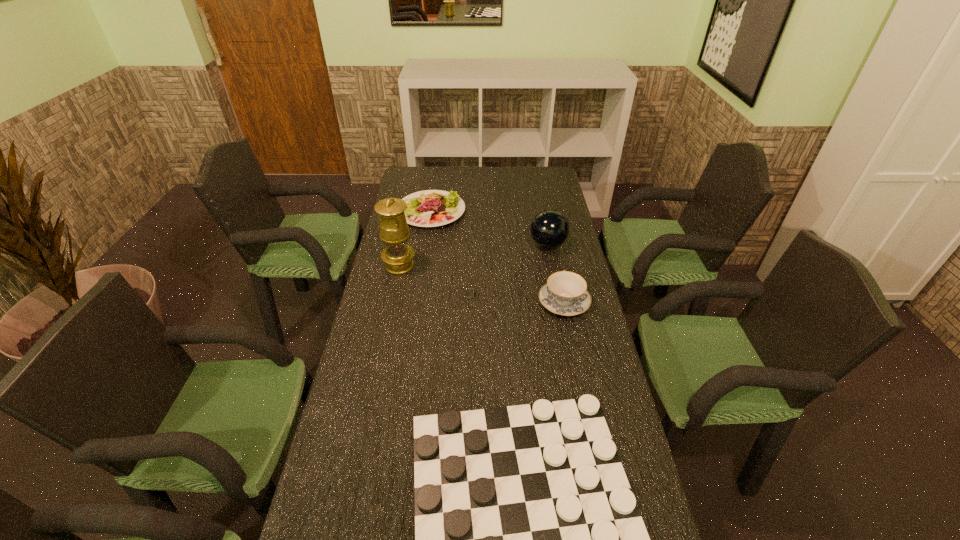
Identify the location of oil lamp. (394, 232).

Locate an element on the screen. bowling ball is located at coordinates (549, 229).

The image size is (960, 540). What are the coordinates of `chinaware` in the screenshot? It's located at (565, 293).

Where is `salad plate`? salad plate is located at coordinates (429, 208).

Find the location of `the farthest object`. the farthest object is located at coordinates 429,208.

Where is `watch`? watch is located at coordinates coord(469,293).

Locate an element on the screen. free space located 0.300m on the front of the tallest object is located at coordinates (383, 340).

The height and width of the screenshot is (540, 960). Find the location of `free location located on the side of the bowling ball with the finger holes`. free location located on the side of the bowling ball with the finger holes is located at coordinates (501, 245).

The width and height of the screenshot is (960, 540). Identify the location of free location located 0.260m on the side of the bowling ball with the finger holes. (463, 245).

At what (x,y) coordinates should I click in order to perform the action: click on free region located on the side of the bowling ball with the finger holes. Please return your answer as a coordinate pair (x, y). This screenshot has width=960, height=540. Looking at the image, I should click on (491, 245).